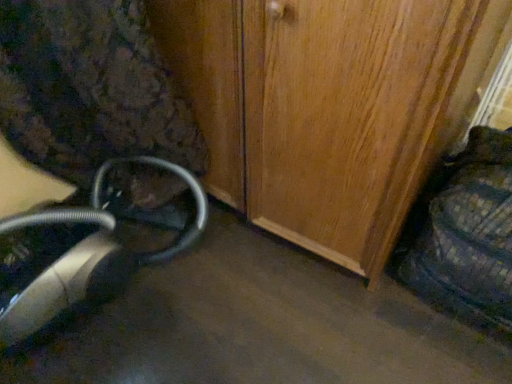
Where is `vacant space that is to the left of plaid fabric swivel chair at right`? Image resolution: width=512 pixels, height=384 pixels. vacant space that is to the left of plaid fabric swivel chair at right is located at coordinates (341, 312).